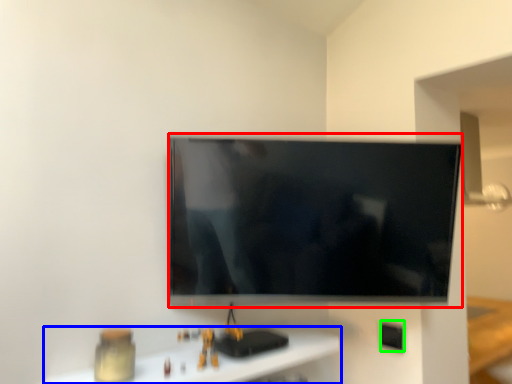
Question: Which is nearer to the television (highlighted by a red box)? furniture (highlighted by a blue box) or electric outlet (highlighted by a green box).

Choices:
 (A) furniture
 (B) electric outlet

Answer: (A)